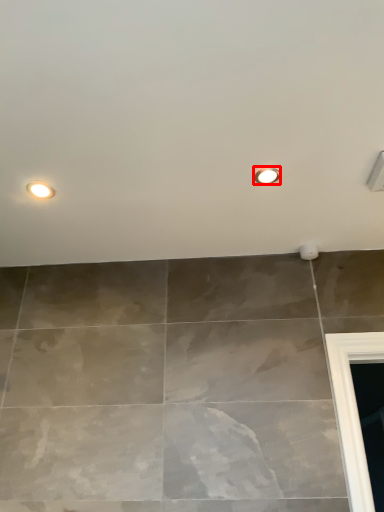
Question: Observing the image, what is the correct spatial positioning of droplight (annotated by the red box) in reference to droplight?

Choices:
 (A) left
 (B) right

Answer: (B)